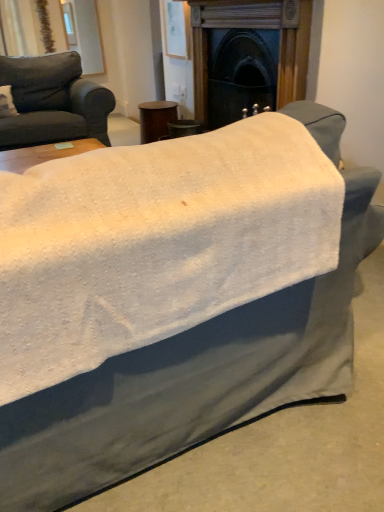
Question: Is matte gray couch at left next to dark wood fireplace at center?

Choices:
 (A) no
 (B) yes

Answer: (A)

Question: Would you say matte gray couch at left contains dark wood fireplace at center?

Choices:
 (A) no
 (B) yes

Answer: (A)

Question: Does matte gray couch at left have a greater width compared to dark wood fireplace at center?

Choices:
 (A) yes
 (B) no

Answer: (A)

Question: Considering the relative sizes of matte gray couch at left and dark wood fireplace at center in the image provided, is matte gray couch at left thinner than dark wood fireplace at center?

Choices:
 (A) no
 (B) yes

Answer: (A)

Question: Can you confirm if matte gray couch at left is shorter than dark wood fireplace at center?

Choices:
 (A) yes
 (B) no

Answer: (A)

Question: Can you confirm if matte gray couch at left is smaller than dark wood fireplace at center?

Choices:
 (A) no
 (B) yes

Answer: (A)

Question: Does matte gray couch at left have a smaller size compared to brown wood side table at center?

Choices:
 (A) no
 (B) yes

Answer: (A)

Question: Is matte gray couch at left oriented away from brown wood side table at center?

Choices:
 (A) no
 (B) yes

Answer: (A)

Question: From the image's perspective, is matte gray couch at left below brown wood side table at center?

Choices:
 (A) no
 (B) yes

Answer: (B)

Question: Does matte gray couch at left have a lesser height compared to brown wood side table at center?

Choices:
 (A) no
 (B) yes

Answer: (A)

Question: Would you consider matte gray couch at left to be distant from brown wood side table at center?

Choices:
 (A) no
 (B) yes

Answer: (A)

Question: Can you confirm if matte gray couch at left is bigger than brown wood side table at center?

Choices:
 (A) yes
 (B) no

Answer: (A)

Question: Considering the relative positions of brown wood side table at center and dark wood fireplace at center in the image provided, is brown wood side table at center in front of dark wood fireplace at center?

Choices:
 (A) no
 (B) yes

Answer: (A)